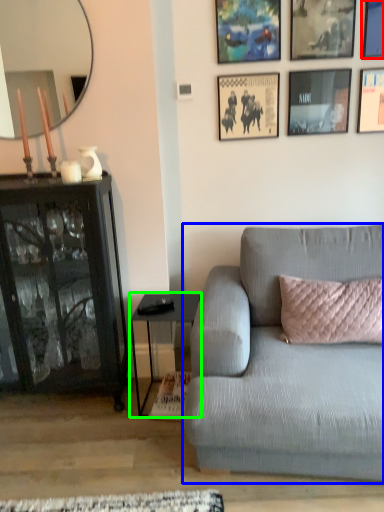
Question: Which object is the farthest from picture frame (highlighted by a red box)? Choose among these: studio couch (highlighted by a blue box) or table (highlighted by a green box).

Choices:
 (A) studio couch
 (B) table

Answer: (B)